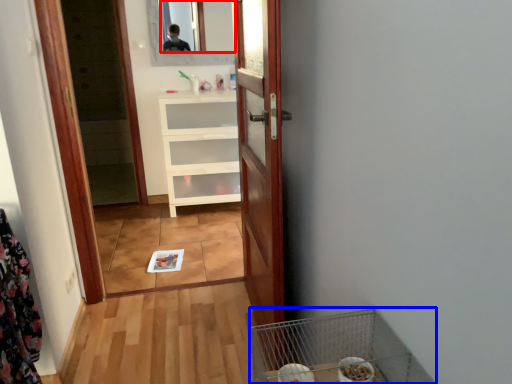
Question: Which object appears closest to the camera in this image, mirror (highlighted by a red box) or bird cage (highlighted by a blue box)?

Choices:
 (A) mirror
 (B) bird cage

Answer: (B)